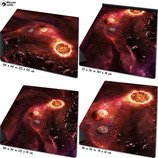
Locate an element on the screen. The height and width of the screenshot is (158, 158). picture in the top right is located at coordinates (130, 29).